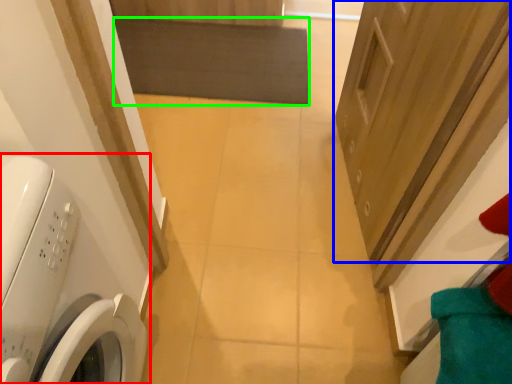
Question: Which object is the closest to the washing machine (highlighted by a red box)? Choose among these: door (highlighted by a blue box) or mat (highlighted by a green box).

Choices:
 (A) door
 (B) mat

Answer: (A)